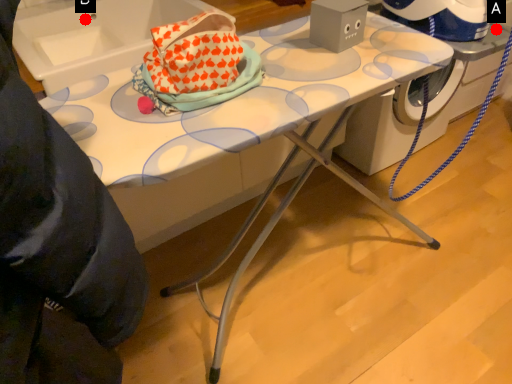
Question: Two points are circled on the image, labeled by A and B beside each circle. Which point is farther from the camera taking this photo?

Choices:
 (A) A is further
 (B) B is further

Answer: (B)